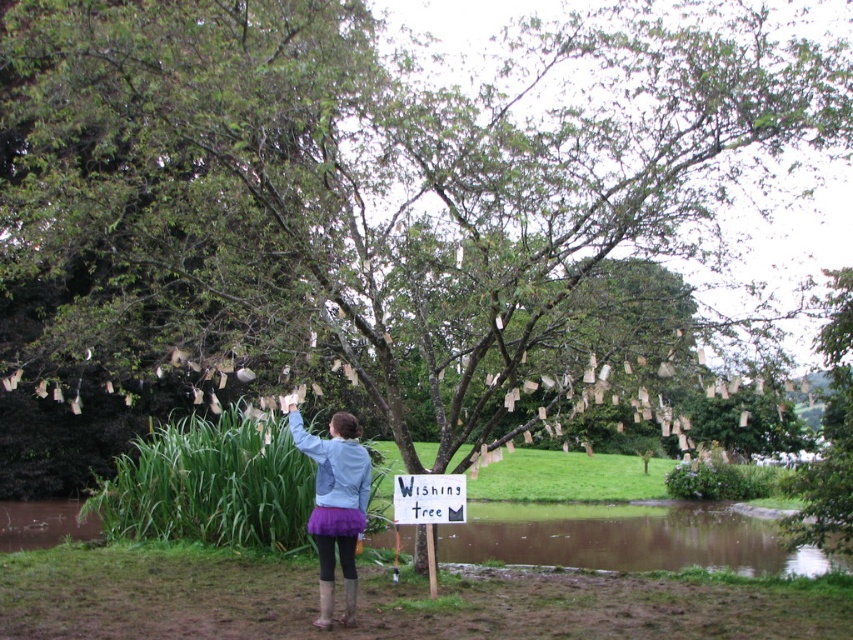
What do you see at coordinates (334, 502) in the screenshot?
I see `purple tulle skirt at center` at bounding box center [334, 502].

How much distance is there between purple tulle skirt at center and white paper sign at center?

3.52 feet

Who is more forward, (329, 496) or (437, 481)?

Point (329, 496) is in front.

Locate an element on the screen. This screenshot has height=640, width=853. purple tulle skirt at center is located at coordinates (334, 502).